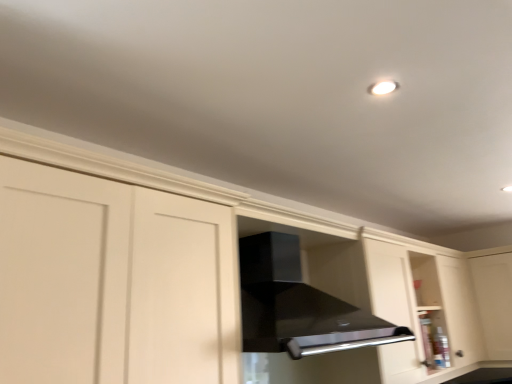
What is the approximate height of black glossy vent at center?

The height of black glossy vent at center is 48.65 centimeters.

What do you see at coordinates (298, 306) in the screenshot? This screenshot has width=512, height=384. I see `black glossy vent at center` at bounding box center [298, 306].

I want to click on black glossy vent at center, so click(x=298, y=306).

This screenshot has width=512, height=384. What do you see at coordinates (493, 301) in the screenshot? I see `transparent glass cabinet at right` at bounding box center [493, 301].

Find the location of a particular element. The image size is (512, 384). transparent glass cabinet at right is located at coordinates (493, 301).

Identify the location of black glossy vent at center. Image resolution: width=512 pixels, height=384 pixels. (298, 306).

Is transparent glass cabinet at right at the left side of black glossy vent at center?

No, transparent glass cabinet at right is not to the left of black glossy vent at center.

Is transparent glass cabinet at right in front of black glossy vent at center?

No, transparent glass cabinet at right is further to the viewer.

Considering the points (487, 277) and (273, 322), which point is behind, point (487, 277) or point (273, 322)?

The point (487, 277) is more distant.

From the image's perspective, is transparent glass cabinet at right located beneath black glossy vent at center?

Yes.

From a real-world perspective, which object rests below the other?

transparent glass cabinet at right.

Between transparent glass cabinet at right and black glossy vent at center, which one has larger width?

black glossy vent at center is wider.

Considering the relative sizes of transparent glass cabinet at right and black glossy vent at center in the image provided, is transparent glass cabinet at right shorter than black glossy vent at center?

No.

Between transparent glass cabinet at right and black glossy vent at center, which one has smaller size?

transparent glass cabinet at right.

Is black glossy vent at center completely or partially inside transparent glass cabinet at right?

No, transparent glass cabinet at right does not contain black glossy vent at center.

Is transparent glass cabinet at right far away from black glossy vent at center?

Yes, transparent glass cabinet at right and black glossy vent at center are quite far apart.

Does transparent glass cabinet at right turn towards black glossy vent at center?

Yes, transparent glass cabinet at right is turned towards black glossy vent at center.

Consider the image. What's the angular difference between transparent glass cabinet at right and black glossy vent at center's facing directions?

The angular difference between transparent glass cabinet at right and black glossy vent at center is 87.9 degrees.

How distant is transparent glass cabinet at right from black glossy vent at center?

transparent glass cabinet at right and black glossy vent at center are 5.13 feet apart from each other.

Find the location of a particular element. Image resolution: width=512 pixels, height=384 pixels. vent in front of the transparent glass cabinet at right is located at coordinates (298, 306).

Is black glossy vent at center to the right of transparent glass cabinet at right from the viewer's perspective?

No, black glossy vent at center is not to the right of transparent glass cabinet at right.

Is the depth of black glossy vent at center greater than that of transparent glass cabinet at right?

No, it is in front of transparent glass cabinet at right.

Is point (255, 269) closer or farther from the camera than point (498, 293)?

Point (255, 269).

From the image's perspective, relative to transparent glass cabinet at right, is black glossy vent at center above or below?

Clearly, from the image's perspective, black glossy vent at center is above transparent glass cabinet at right.

From a real-world perspective, is black glossy vent at center positioned above or below transparent glass cabinet at right?

Clearly, from a real-world perspective, black glossy vent at center is above transparent glass cabinet at right.

Based on the photo, which object is thinner, black glossy vent at center or transparent glass cabinet at right?

transparent glass cabinet at right.

Considering the relative sizes of black glossy vent at center and transparent glass cabinet at right in the image provided, is black glossy vent at center taller than transparent glass cabinet at right?

No, black glossy vent at center is not taller than transparent glass cabinet at right.

Can you confirm if black glossy vent at center is bigger than transparent glass cabinet at right?

Yes, black glossy vent at center is bigger than transparent glass cabinet at right.

Is transparent glass cabinet at right a part of black glossy vent at center?

No.

Are black glossy vent at center and transparent glass cabinet at right located far from each other?

Yes, black glossy vent at center and transparent glass cabinet at right are quite far apart.

Does black glossy vent at center turn towards transparent glass cabinet at right?

No, black glossy vent at center is not turned towards transparent glass cabinet at right.

How different are the orientations of black glossy vent at center and transparent glass cabinet at right in degrees?

87.9 degrees separate the facing orientations of black glossy vent at center and transparent glass cabinet at right.

This screenshot has height=384, width=512. In order to click on vent in front of the transparent glass cabinet at right in this screenshot , I will do 298,306.

Identify the location of vent that appears on the left of transparent glass cabinet at right. (298, 306).

Find the location of a particular element. This screenshot has width=512, height=384. glass door below the black glossy vent at center (from a real-world perspective) is located at coordinates (493, 301).